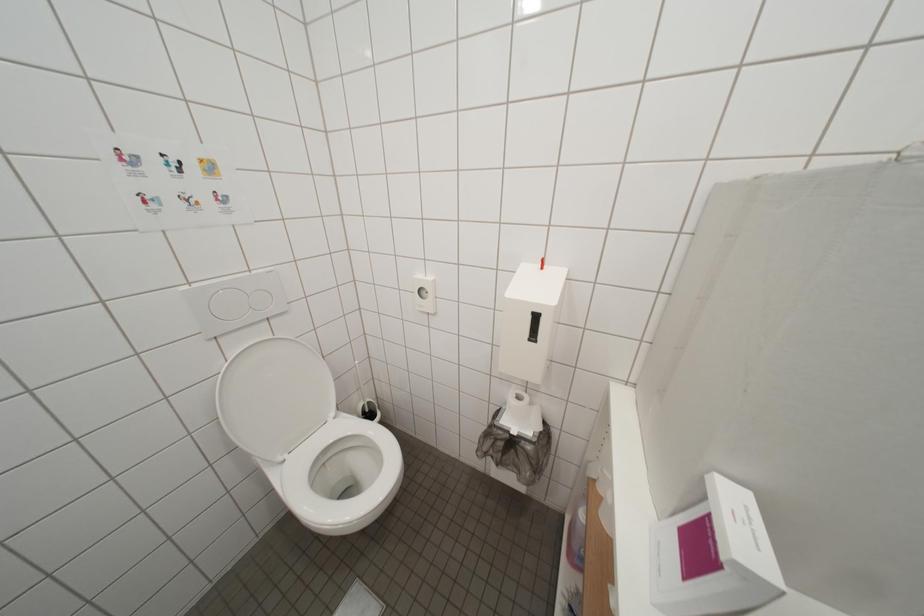
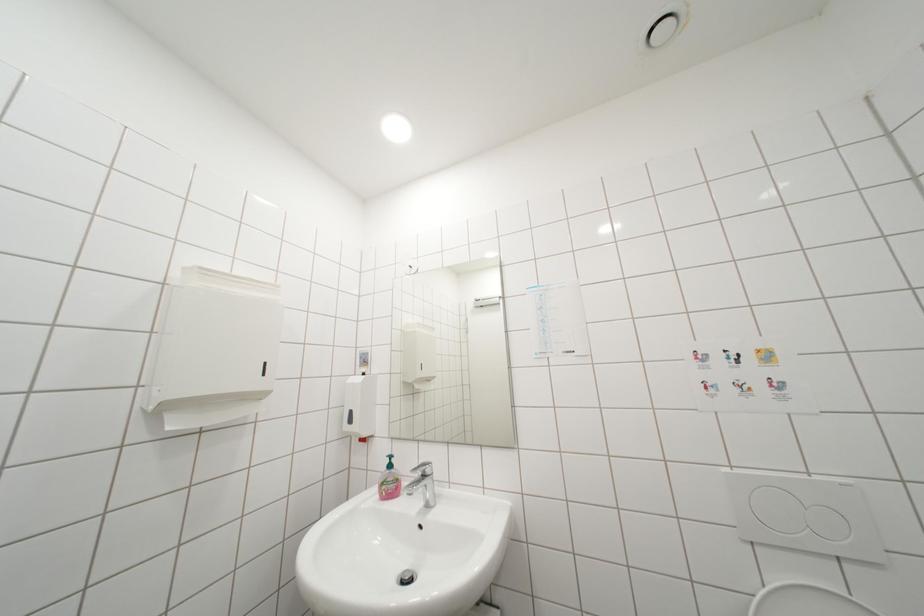
Question: The camera is either moving clockwise (left) or counter-clockwise (right) around the object. The first image is from the beginning of the video and the second image is from the end. Is the camera moving left or right when shooting the video?

Choices:
 (A) Left
 (B) Right

Answer: (B)